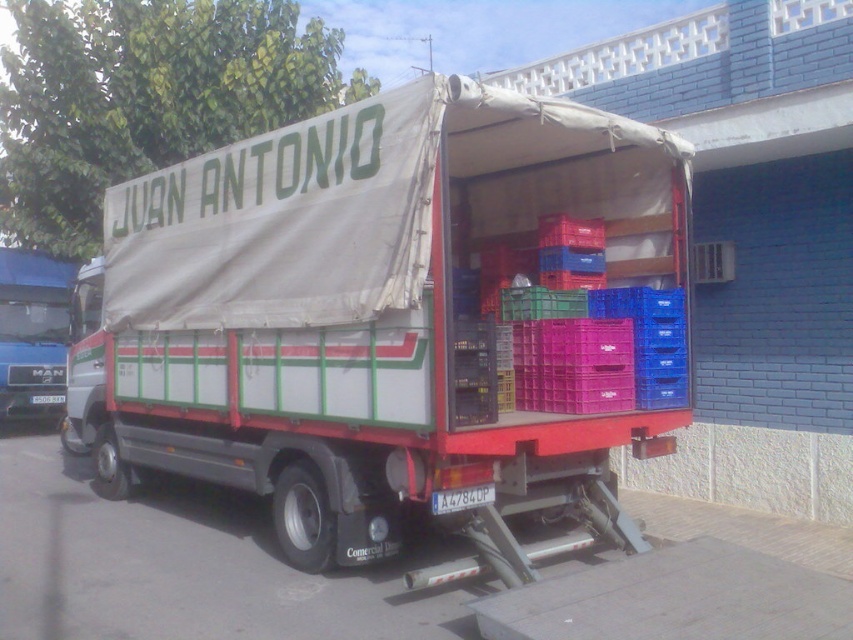
Question: Can you confirm if white canvas truck at center is smaller than blue metallic truck at left?

Choices:
 (A) no
 (B) yes

Answer: (A)

Question: Can you confirm if white canvas truck at center is positioned to the right of blue metallic truck at left?

Choices:
 (A) no
 (B) yes

Answer: (B)

Question: From the image, what is the correct spatial relationship of white canvas truck at center in relation to blue metallic truck at left?

Choices:
 (A) right
 (B) left

Answer: (A)